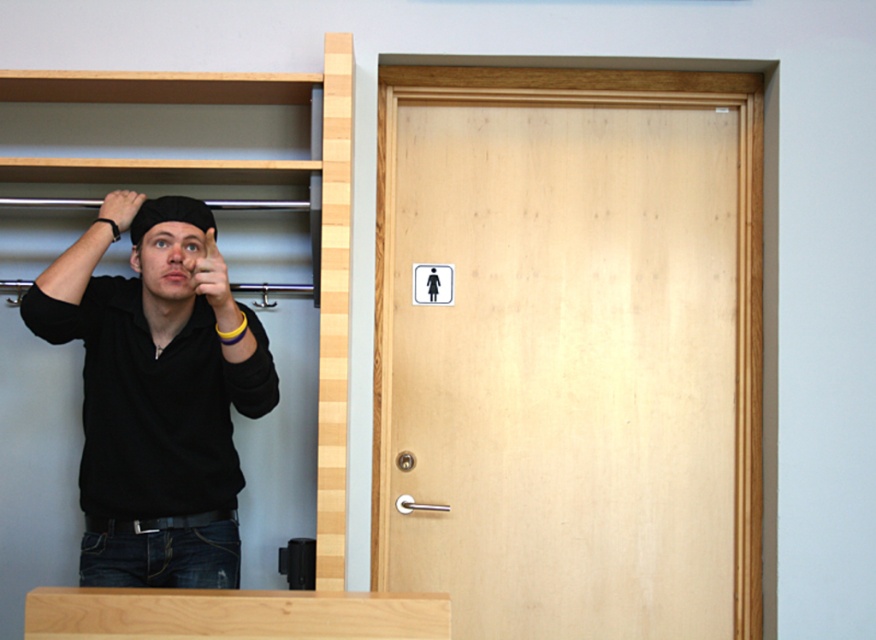
You are an observer in the scene. You notice the matte black hand at upper center and the black matte wristband at upper left. Which object is positioned lower from your viewpoint?

The matte black hand at upper center is located below the black matte wristband at upper left, so the matte black hand at upper center is positioned lower from your viewpoint.

You are an interior designer assessing the space between the matte black hand at upper center and the black matte wristband at upper left. If you want to place a decorative item between them, would you need to consider their width difference?

The matte black hand at upper center might be wider than the black matte wristband at upper left, so you should consider the width difference to ensure the decorative item fits appropriately between them.

You are standing in front of the wardrobe and see a point marked at coordinates (x=154, y=403). What object is located at that point?

The black matte shirt at upper left is located at point (x=154, y=403).